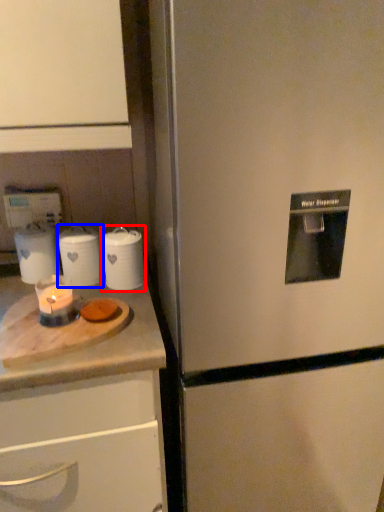
Question: Among these objects, which one is nearest to the camera, kitchen appliance (highlighted by a red box) or kitchen appliance (highlighted by a blue box)?

Choices:
 (A) kitchen appliance
 (B) kitchen appliance

Answer: (A)